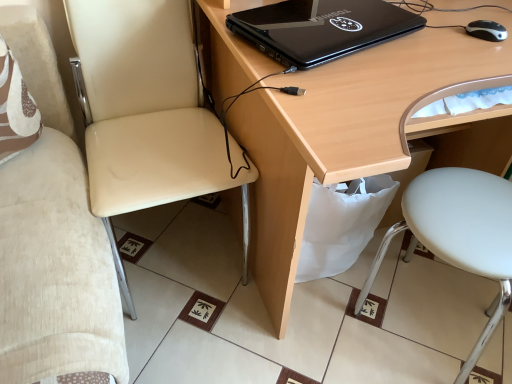
This screenshot has height=384, width=512. I want to click on vacant area situated below beige leather chair at left, which is the first chair from left to right (from a real-world perspective), so point(169,245).